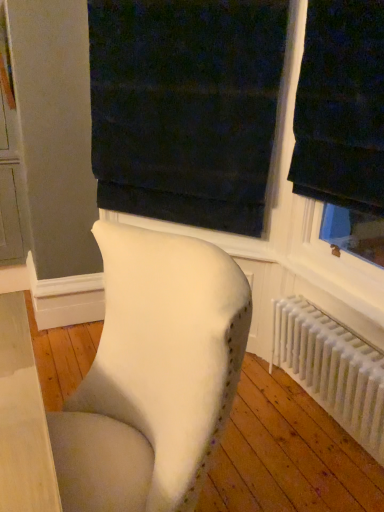
The height and width of the screenshot is (512, 384). I want to click on dark velvet curtain at upper center, so [186, 106].

Considering the relative sizes of white plastic radiator at lower right and white fabric chair at center in the image provided, is white plastic radiator at lower right taller than white fabric chair at center?

No, white plastic radiator at lower right is not taller than white fabric chair at center.

Is white plastic radiator at lower right not close to white fabric chair at center?

white plastic radiator at lower right is near white fabric chair at center, not far away.

Is white plastic radiator at lower right positioned beyond the bounds of white fabric chair at center?

Indeed, white plastic radiator at lower right is completely outside white fabric chair at center.

Which is nearer, (325, 334) or (169, 439)?

Positioned in front is point (169, 439).

From the picture: Considering the relative positions of dark velvet curtain at upper center and white plastic radiator at lower right in the image provided, is dark velvet curtain at upper center behind white plastic radiator at lower right?

Yes, dark velvet curtain at upper center is behind white plastic radiator at lower right.

The image size is (384, 512). I want to click on radiator that appears on the right of dark velvet curtain at upper center, so click(332, 368).

Is dark velvet curtain at upper center to the right of white plastic radiator at lower right from the viewer's perspective?

No, dark velvet curtain at upper center is not to the right of white plastic radiator at lower right.

Can you confirm if dark velvet curtain at upper center is thinner than white plastic radiator at lower right?

Indeed, dark velvet curtain at upper center has a lesser width compared to white plastic radiator at lower right.

From a real-world perspective, which is physically above, white fabric chair at center or dark velvet curtain at upper center?

dark velvet curtain at upper center is physically above.

Does white fabric chair at center have a greater height compared to dark velvet curtain at upper center?

No, white fabric chair at center is not taller than dark velvet curtain at upper center.

Is white fabric chair at center not within dark velvet curtain at upper center?

Yes, white fabric chair at center is not within dark velvet curtain at upper center.

Is the depth of white fabric chair at center less than that of dark velvet curtain at upper center?

Yes, the depth of white fabric chair at center is less than that of dark velvet curtain at upper center.

The width and height of the screenshot is (384, 512). Find the location of `curtain above the white plastic radiator at lower right (from a real-world perspective)`. curtain above the white plastic radiator at lower right (from a real-world perspective) is located at coordinates (186, 106).

From a real-world perspective, which object rests below the other?

white plastic radiator at lower right is physically lower.

Can you tell me how much white plastic radiator at lower right and dark velvet curtain at upper center differ in facing direction?

45.4 degrees separate the facing orientations of white plastic radiator at lower right and dark velvet curtain at upper center.

Would you say dark velvet curtain at upper center is part of white plastic radiator at lower right's contents?

No, dark velvet curtain at upper center is located outside of white plastic radiator at lower right.

Can white fabric chair at center be found inside dark velvet curtain at upper center?

No, white fabric chair at center is not inside dark velvet curtain at upper center.

How different are the orientations of dark velvet curtain at upper center and white fabric chair at center in degrees?

The angle between the facing direction of dark velvet curtain at upper center and the facing direction of white fabric chair at center is 45.5 degrees.

From the picture: Is the surface of dark velvet curtain at upper center in direct contact with white fabric chair at center?

There is a gap between dark velvet curtain at upper center and white fabric chair at center.

Between dark velvet curtain at upper center and white fabric chair at center, which one has smaller width?

With smaller width is dark velvet curtain at upper center.

Who is taller, white fabric chair at center or white plastic radiator at lower right?

Standing taller between the two is white fabric chair at center.

Which object is further away from the camera, white fabric chair at center or white plastic radiator at lower right?

Positioned behind is white plastic radiator at lower right.

Considering the relative sizes of white fabric chair at center and white plastic radiator at lower right in the image provided, is white fabric chair at center thinner than white plastic radiator at lower right?

No.

Where is `chair lying in front of the white plastic radiator at lower right`? The image size is (384, 512). chair lying in front of the white plastic radiator at lower right is located at coordinates (154, 375).

Find the location of a particular element. Image resolution: width=384 pixels, height=512 pixels. curtain that appears above the white plastic radiator at lower right (from a real-world perspective) is located at coordinates tap(186, 106).

Based on their spatial positions, is dark velvet curtain at upper center or white plastic radiator at lower right closer to white fabric chair at center?

Among the two, white plastic radiator at lower right is located nearer to white fabric chair at center.

Estimate the real-world distances between objects in this image. Which object is further from white plastic radiator at lower right, dark velvet curtain at upper center or white fabric chair at center?

white fabric chair at center.

From the image, which object appears to be farther from dark velvet curtain at upper center, white plastic radiator at lower right or white fabric chair at center?

white fabric chair at center lies further to dark velvet curtain at upper center than the other object.

Based on their spatial positions, is white fabric chair at center or dark velvet curtain at upper center further from white plastic radiator at lower right?

Based on the image, white fabric chair at center appears to be further to white plastic radiator at lower right.

Considering their positions, is white plastic radiator at lower right positioned closer to white fabric chair at center than dark velvet curtain at upper center?

white plastic radiator at lower right is positioned closer to the anchor white fabric chair at center.

From the image, which object appears to be farther from dark velvet curtain at upper center, white fabric chair at center or white plastic radiator at lower right?

white fabric chair at center.

This screenshot has width=384, height=512. Identify the location of chair between dark velvet curtain at upper center and white plastic radiator at lower right from top to bottom. (154, 375).